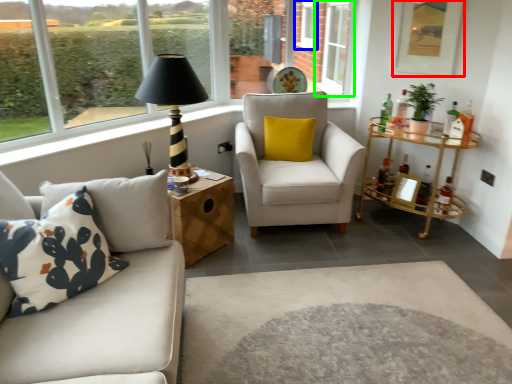
Question: Which object is the farthest from picture frame (highlighted by a red box)? Choose among these: window (highlighted by a blue box) or window (highlighted by a green box).

Choices:
 (A) window
 (B) window

Answer: (A)